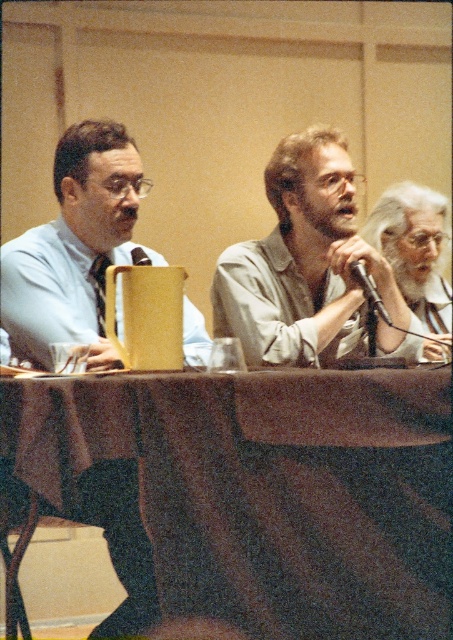
You are a server who needs to place a 12 inch wide tray of snacks between the brown fabric table at center and the matte black shirt at left. Will there be enough space?

The brown fabric table at center and matte black shirt at left are 20.49 inches apart. Since the tray is 12 inches wide, there is sufficient space to place it between them as the distance is greater than the tray width.

You are organizing a small meeting and need to place a 1.5 meter long laptop stand on the table. Given the brown fabric table at center and the light gray shirt at center, which object can accommodate the laptop stand based on their sizes?

The brown fabric table at center can accommodate the laptop stand because its width is larger than the light gray shirt at center.